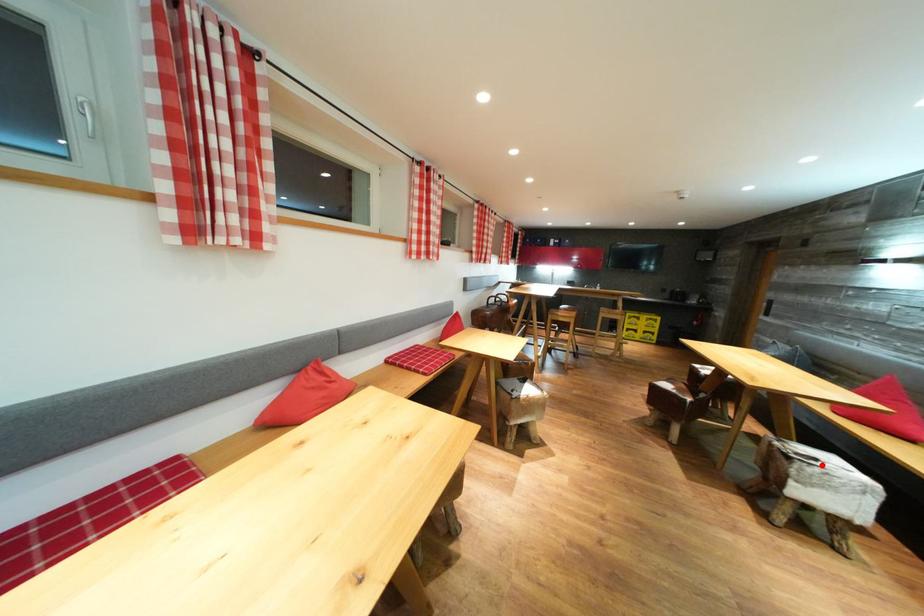
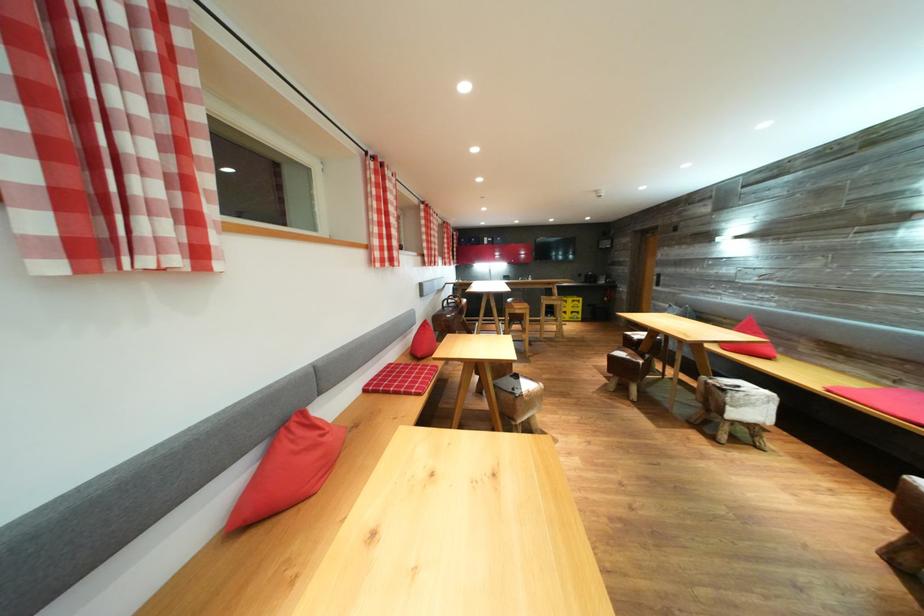
Question: I am providing you with two images of the same scene from different viewpoints. Given a red point in image1, look at the same physical point in image2. Is it:

Choices:
 (A) Closer to the viewpoint
 (B) Farther from the viewpoint

Answer: (B)